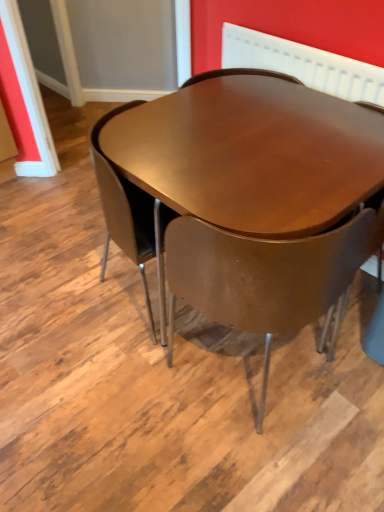
Question: Does matte brown chair at center come in front of shiny brown table at center?

Choices:
 (A) no
 (B) yes

Answer: (B)

Question: Can you confirm if matte brown chair at center is bigger than shiny brown table at center?

Choices:
 (A) no
 (B) yes

Answer: (A)

Question: From the image's perspective, is matte brown chair at center below shiny brown table at center?

Choices:
 (A) no
 (B) yes

Answer: (B)

Question: Can we say matte brown chair at center lies outside shiny brown table at center?

Choices:
 (A) no
 (B) yes

Answer: (A)

Question: Is matte brown chair at center far from shiny brown table at center?

Choices:
 (A) yes
 (B) no

Answer: (B)

Question: Is matte brown chair at center positioned behind shiny brown table at center?

Choices:
 (A) no
 (B) yes

Answer: (A)

Question: Can we say matte brown chair at center lies outside white textured radiator at upper center?

Choices:
 (A) yes
 (B) no

Answer: (A)

Question: From the image's perspective, is matte brown chair at center under white textured radiator at upper center?

Choices:
 (A) yes
 (B) no

Answer: (A)

Question: Is matte brown chair at center oriented towards white textured radiator at upper center?

Choices:
 (A) no
 (B) yes

Answer: (A)

Question: Is matte brown chair at center smaller than white textured radiator at upper center?

Choices:
 (A) yes
 (B) no

Answer: (B)

Question: Is matte brown chair at center further to camera compared to white textured radiator at upper center?

Choices:
 (A) yes
 (B) no

Answer: (B)

Question: From a real-world perspective, does matte brown chair at center sit lower than white textured radiator at upper center?

Choices:
 (A) no
 (B) yes

Answer: (B)

Question: Is shiny brown table at center bigger than white textured radiator at upper center?

Choices:
 (A) no
 (B) yes

Answer: (B)